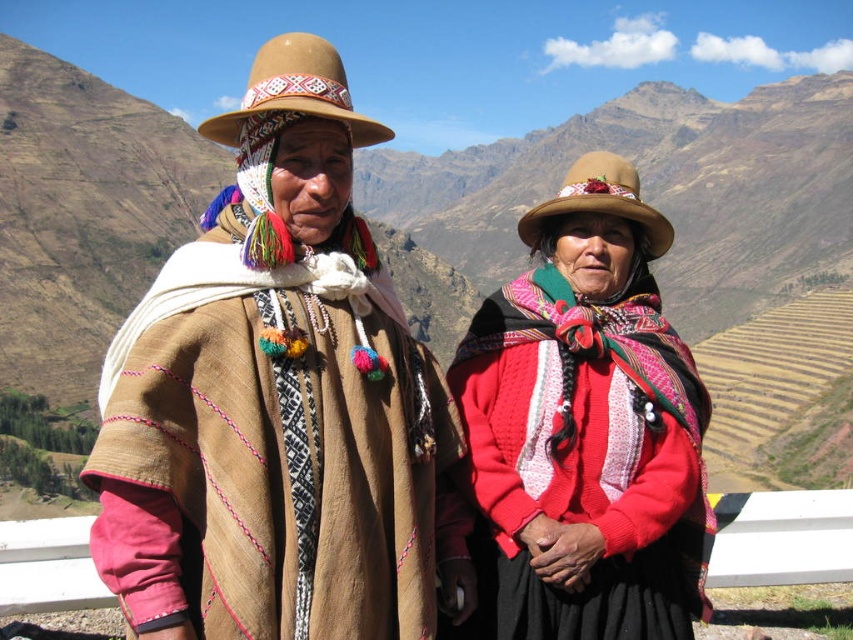
Question: Which of the following is the farthest from the observer?

Choices:
 (A) brown woolen poncho at left
 (B) knitted wool shawl at center
 (C) brown woven hat at center

Answer: (B)

Question: Where is brown woven hat at center located in relation to brown woolen poncho at left in the image?

Choices:
 (A) above
 (B) below

Answer: (A)

Question: Considering the relative positions of brown woven hat at center and brown woolen poncho at left in the image provided, where is brown woven hat at center located with respect to brown woolen poncho at left?

Choices:
 (A) above
 (B) below

Answer: (A)

Question: Which point appears closest to the camera in this image?

Choices:
 (A) (315, 620)
 (B) (544, 621)
 (C) (590, 314)

Answer: (A)

Question: Can you confirm if brown woven hat at center is thinner than knitted wool shawl at center?

Choices:
 (A) no
 (B) yes

Answer: (A)

Question: Estimate the real-world distances between objects in this image. Which object is farther from the brown woven hat at center?

Choices:
 (A) brown woolen poncho at left
 (B) knitted wool shawl at center

Answer: (B)